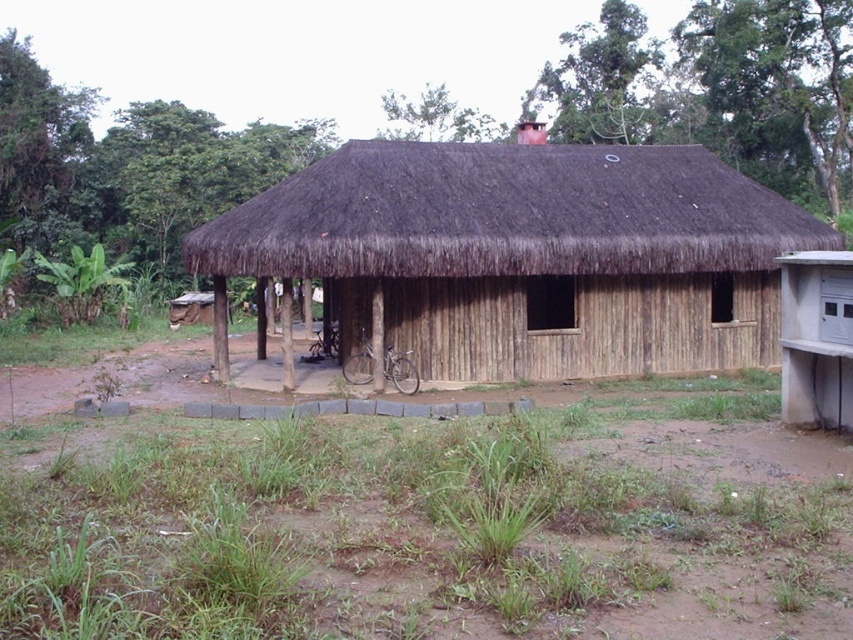
Based on the photo, you are standing in front of the rustic wooden structure and need to walk to the brown thatch at center. Which direction should you head from the brown dirt field at center?

The brown dirt field at center is to the left of brown thatch at center, so you should head to the right to reach the brown thatch at center from the brown dirt field at center.

You are planning to build a small garden in the brown dirt field at center. Considering the height of the brown thatch at center, will the garden plants be visible from the front of the hut?

The brown dirt field at center is shorter than the brown thatch at center, so the garden plants grown in the brown dirt field at center will be hidden by the taller brown thatch at center, making them less visible from the front of the hut.

You are planning to build a small garden in the area shown in the image. You want to know which area is wider between the brown dirt field at center and the brown thatch at center. Which one is wider?

The brown thatch at center is wider than the brown dirt field at center according to the description.